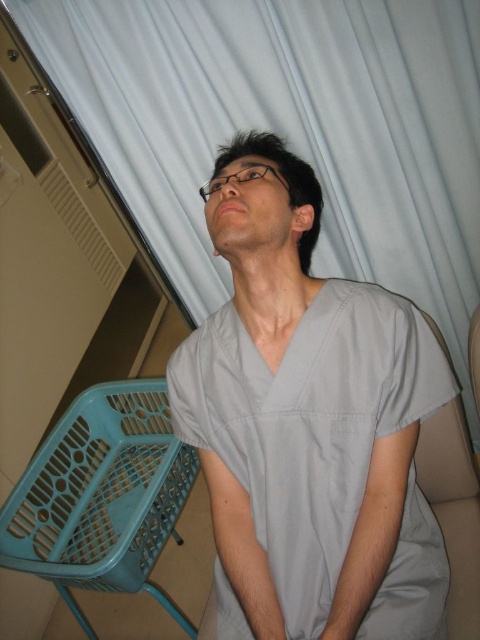
A person is sitting in a room with a teal laundry basket. If the person wants to reach an object located at point (363, 68), which is 3.69 feet away from them, can they do so without moving their hands from their lap?

The object located at point (363, 68) is 3.69 feet away from the person. Since the person is sitting with their hands resting on their lap, it is unlikely they can reach 3.69 feet without moving their hands.

In the scene shown: You are designing a new healthcare room layout and need to ensure that the gray matte scrubs at center and the beige fabric chair at lower right are placed appropriately. Given their sizes, which object should be positioned closer to the entrance to allow easier access?

The beige fabric chair at lower right should be positioned closer to the entrance because it is smaller than the gray matte scrubs at center, making it easier to access and maneuver around.

You are a patient in a hospital room and need to locate the curtains to adjust the light. You see a white fabric curtain at upper center and a beige fabric chair at lower right. Which object is positioned higher up in the room?

The white fabric curtain at upper center is positioned higher up in the room than the beige fabric chair at lower right.